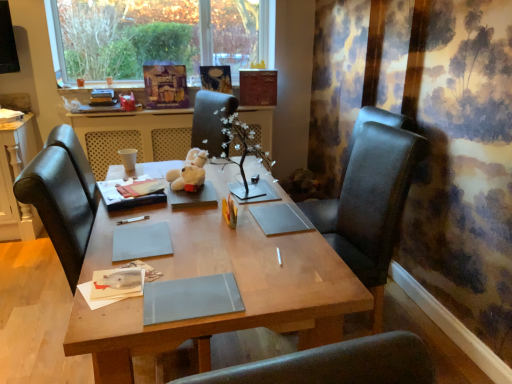
Where is `free space to the left of matte gray notebook at center, which is counted as the first notebook, starting from the bottom`? This screenshot has width=512, height=384. free space to the left of matte gray notebook at center, which is counted as the first notebook, starting from the bottom is located at coordinates (113, 302).